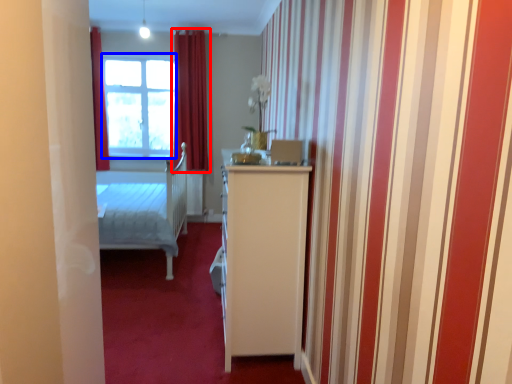
Question: Which object appears farthest to the camera in this image, curtain (highlighted by a red box) or window (highlighted by a blue box)?

Choices:
 (A) curtain
 (B) window

Answer: (B)